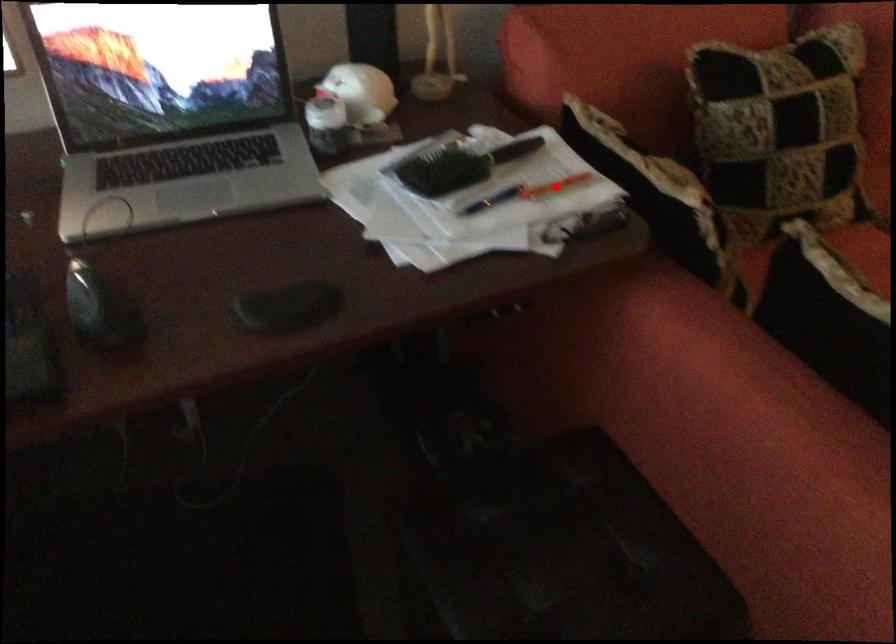
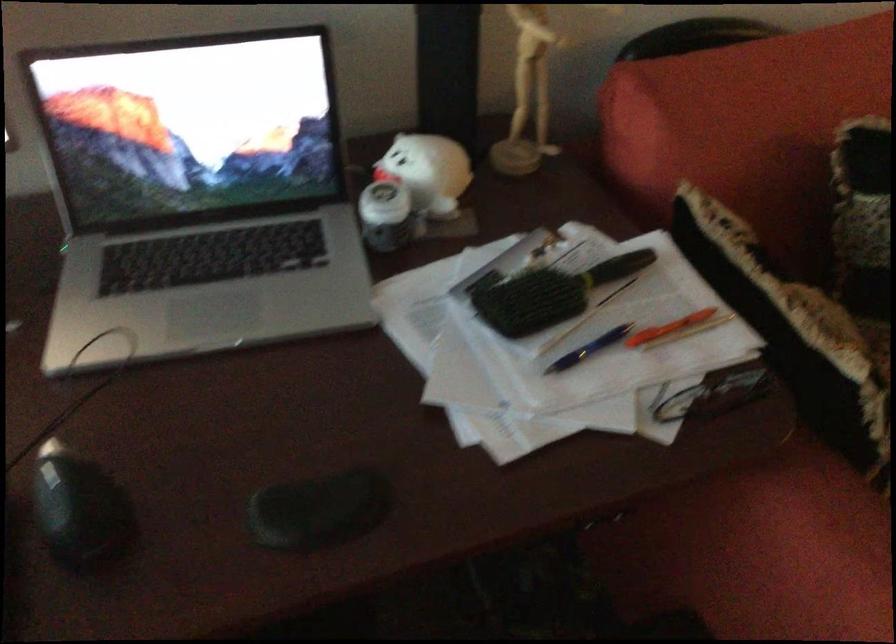
In the second image, find the point that corresponds to the highlighted location in the first image.

(668, 328)